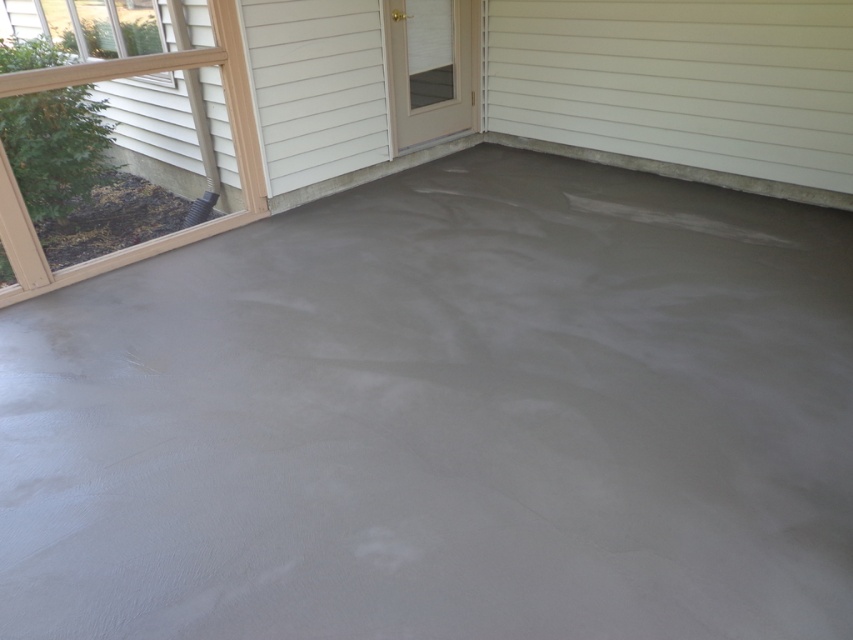
Question: Which object appears closest to the camera in this image?

Choices:
 (A) clear glass screen door at center
 (B) smooth concrete floor at center

Answer: (B)

Question: Is the position of smooth concrete floor at center less distant than that of clear glass screen door at center?

Choices:
 (A) yes
 (B) no

Answer: (A)

Question: Which point is closer to the camera?

Choices:
 (A) (428, 97)
 (B) (706, 112)

Answer: (B)

Question: Does smooth concrete floor at center lie in front of clear glass screen door at center?

Choices:
 (A) no
 (B) yes

Answer: (B)

Question: Does smooth concrete floor at center have a lesser width compared to clear glass screen door at center?

Choices:
 (A) yes
 (B) no

Answer: (B)